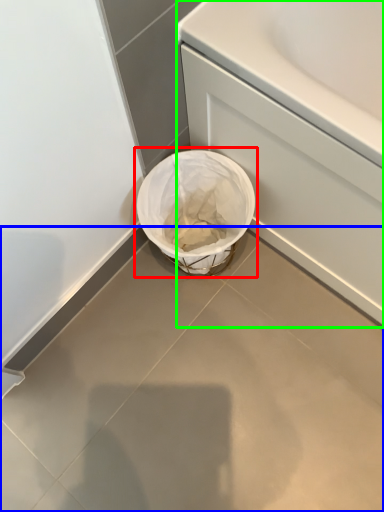
Question: Which object is positioned closest to waste container (highlighted by a red box)? Select from concrete (highlighted by a blue box) and bath (highlighted by a green box).

Choices:
 (A) concrete
 (B) bath

Answer: (B)